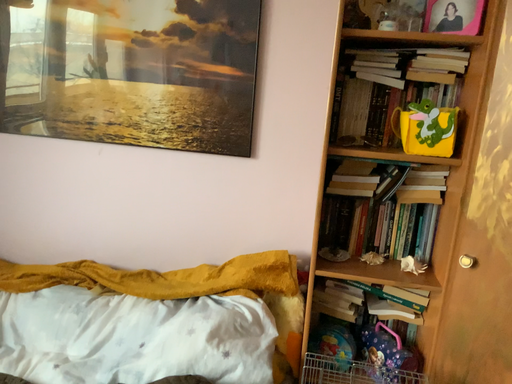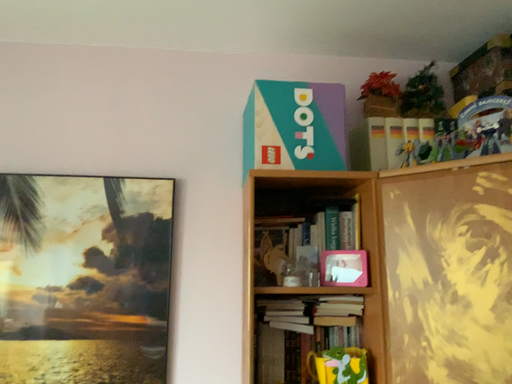
Question: How did the camera likely rotate when shooting the video?

Choices:
 (A) rotated upward
 (B) rotated downward

Answer: (A)